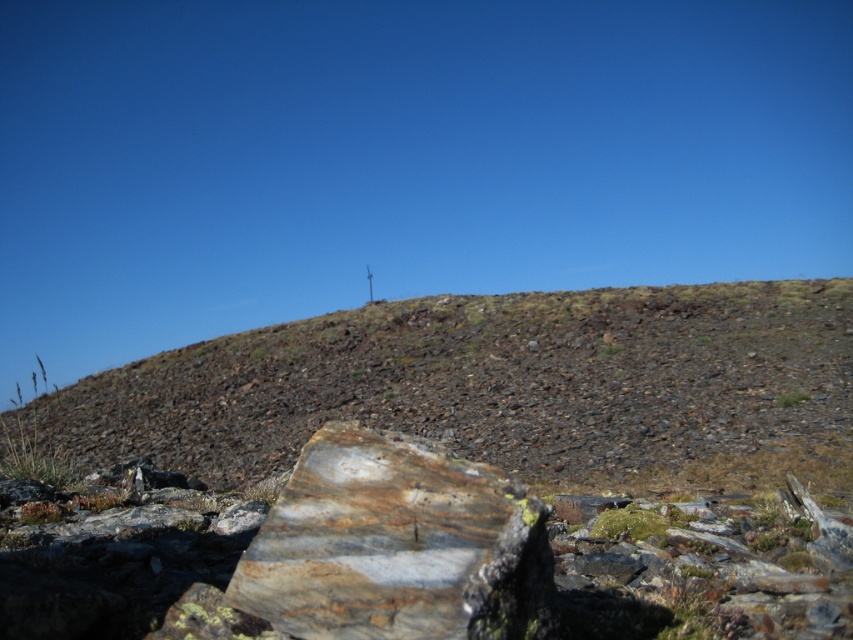
You are a geologist examining the image. You need to determine which object is bigger between the rusty stone hillside at upper center and the rusty stone at center. Based on the scene, which one is larger?

The rusty stone hillside at upper center is larger than the rusty stone at center.

You are a geologist examining the image. You need to determine which object is taller between the rusty stone hillside at upper center and the rusty stone at center. Based on the scene, which one is taller?

The rusty stone hillside at upper center is taller than the rusty stone at center.

You are standing at the point closer to the camera between the two points, point (643,420) and point (512,540). Which point are you standing at?

You are standing at point (643,420) because it is further to the camera than point (512,540).